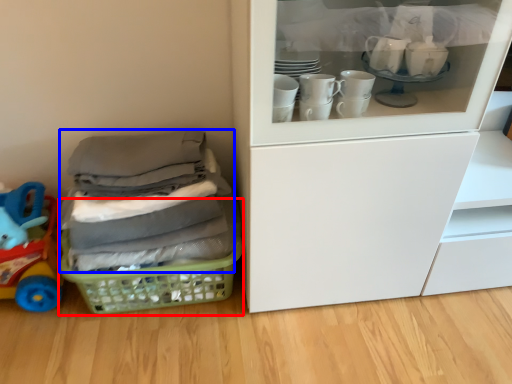
Question: Which point is further to the camera, basket (highlighted by a red box) or clothing (highlighted by a blue box)?

Choices:
 (A) basket
 (B) clothing

Answer: (A)